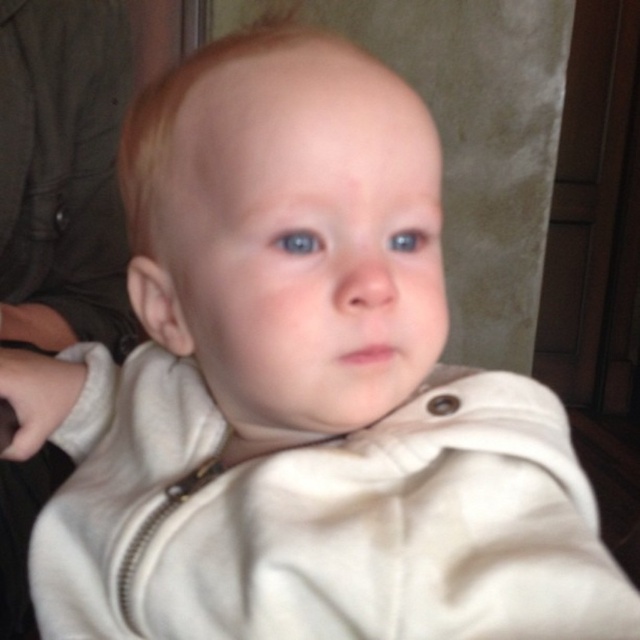
You are a photographer adjusting the focus on your camera. The subject is the baby in the image, and you want to ensure both the white soft jacket at center and the blue glossy eye at upper center are in focus. Given that your camera can only maintain sharp focus within a 20 inch range, will both objects stay in focus simultaneously?

The white soft jacket at center and blue glossy eye at upper center are 21.48 inches apart, which exceeds the camera focus range of 20 inches. Therefore, both objects cannot be in focus at the same time.

You are a photographer adjusting the lighting for a baby photo shoot. You notice the white soft jacket at center and the blue glossy eye at upper center. Which object should you focus on to ensure proper exposure since it takes up more space in the frame?

The white soft jacket at center should be focused on for proper exposure because it is larger in size than the blue glossy eye at upper center.

You are a photographer adjusting the focus on a camera. You notice two blue glossy eyes in the frame. The baby has a blue glossy eye at center and a blue glossy eye at upper center. Which of the two eyes is smaller in size?

The blue glossy eye at center is smaller in size compared to the blue glossy eye at upper center.